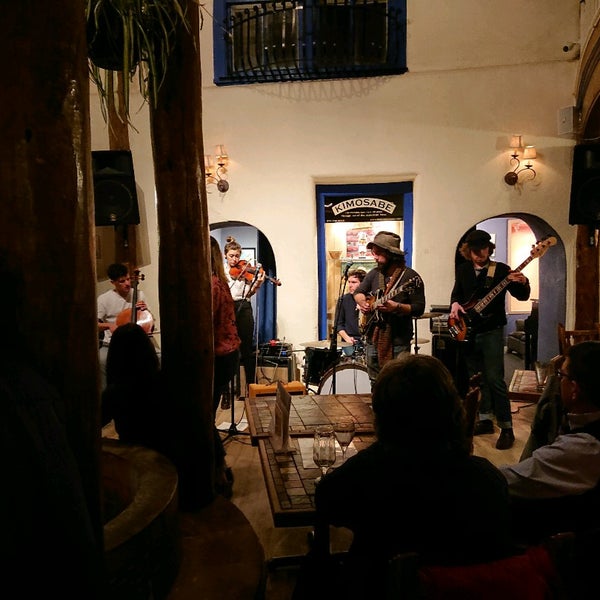
You are a GUI agent. You are given a task and a screenshot of the screen. Output one action in this format:
    pyautogui.click(x=<x>, y=<y>)
    Task: Click on the white back wall
    The image size is (600, 600).
    Given the screenshot: What is the action you would take?
    pyautogui.click(x=448, y=116)